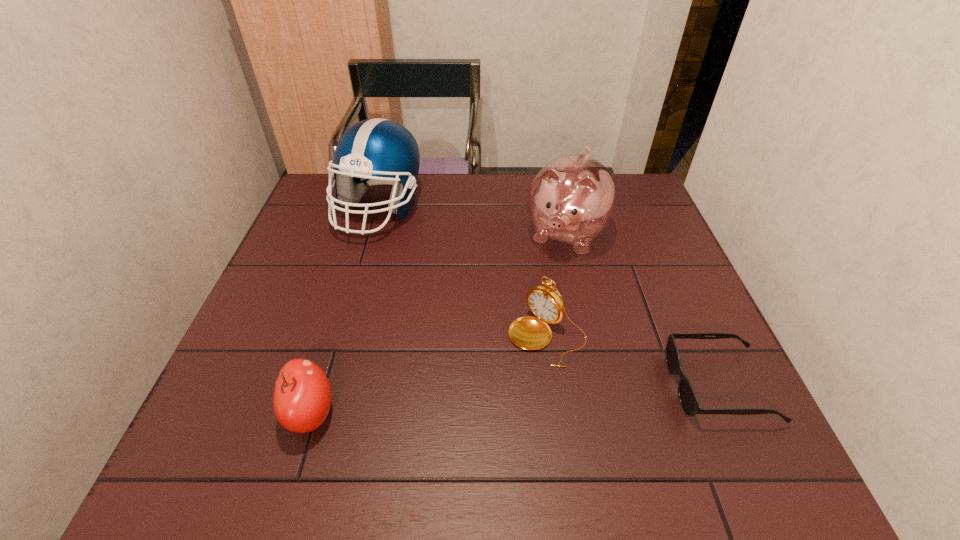
Where is `object at the near left corner`? object at the near left corner is located at coordinates (302, 395).

Identify the location of object that is at the far right corner. (572, 198).

At what (x,y) coordinates should I click in order to perform the action: click on object located at the near right corner. Please return your answer as a coordinate pair (x, y). Looking at the image, I should click on (688, 399).

Image resolution: width=960 pixels, height=540 pixels. Identify the location of vacant area at the far edge. (466, 198).

In the image, there is a desktop. Find the location of `blank space at the near edge`. blank space at the near edge is located at coordinates (483, 412).

Identify the location of free region at the left edge. pos(305,237).

This screenshot has width=960, height=540. In the image, there is a desktop. What are the coordinates of `vacant space at the right edge` in the screenshot? It's located at (705, 354).

I want to click on free spot at the far left corner of the desktop, so click(353, 208).

Locate an element on the screen. free space at the near right corner of the desktop is located at coordinates (697, 417).

Find the location of `free space between the pocket watch and the piggy bank`. free space between the pocket watch and the piggy bank is located at coordinates (557, 286).